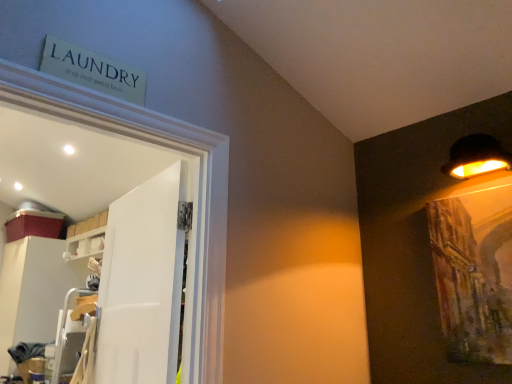
Question: From the image's perspective, relative to white glossy cabinet at left, is white glossy shelf at upper left above or below?

Choices:
 (A) below
 (B) above

Answer: (B)

Question: Looking at their shapes, would you say white glossy shelf at upper left is wider or thinner than white glossy cabinet at left?

Choices:
 (A) wide
 (B) thin

Answer: (B)

Question: Which object is the farthest from the black matte lampshade at upper right?

Choices:
 (A) white matte door at center
 (B) white glossy shelf at upper left
 (C) white glossy cabinet at left

Answer: (C)

Question: Based on their relative distances, which object is nearer to the white matte door at center?

Choices:
 (A) black matte lampshade at upper right
 (B) white glossy shelf at upper left
 (C) white glossy cabinet at left

Answer: (A)